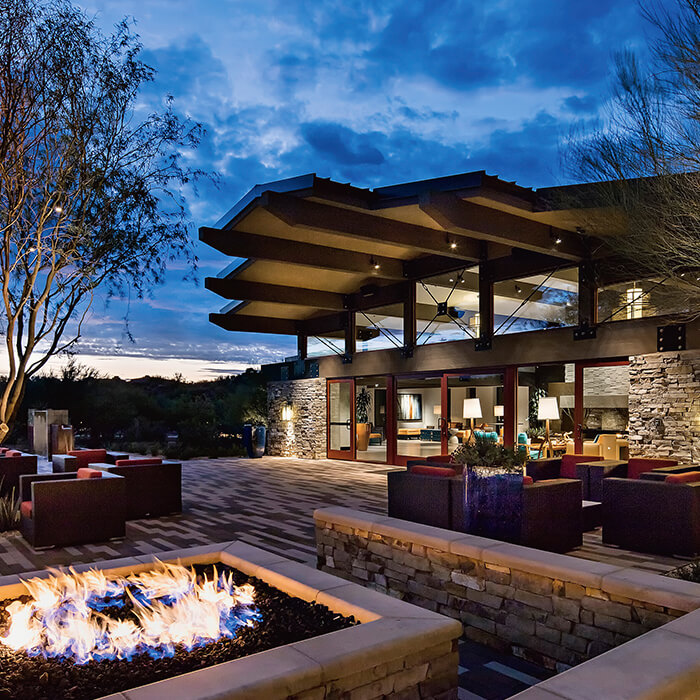
This screenshot has height=700, width=700. I want to click on windows, so click(x=370, y=424), click(x=413, y=409), click(x=481, y=407), click(x=532, y=392), click(x=603, y=404), click(x=610, y=301), click(x=526, y=301), click(x=442, y=314), click(x=372, y=321), click(x=316, y=344).